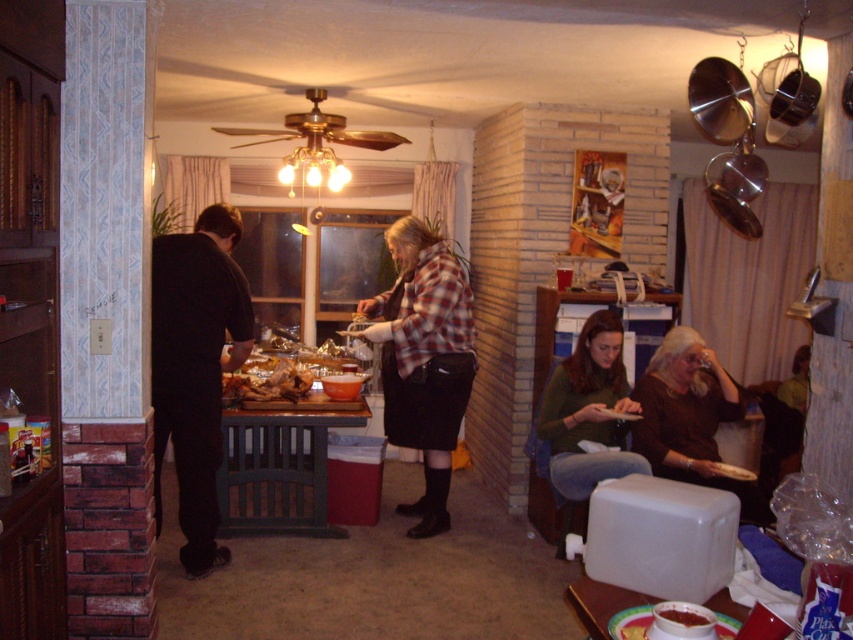
Who is positioned more to the right, black matte suit at left or plaid fabric shirt at center?

plaid fabric shirt at center is more to the right.

Looking at this image, does black matte suit at left have a greater width compared to plaid fabric shirt at center?

No, black matte suit at left is not wider than plaid fabric shirt at center.

Is point (218, 410) positioned after point (389, 314)?

No, (218, 410) is in front of (389, 314).

Locate an element on the screen. The image size is (853, 640). black matte suit at left is located at coordinates (195, 369).

Which is below, golden crispy chicken at center or smooth tomato soup at center?

smooth tomato soup at center is below.

Where is `golden crispy chicken at center`? This screenshot has width=853, height=640. golden crispy chicken at center is located at coordinates (268, 384).

Can you confirm if black matte suit at left is positioned to the left of brown matte sweater at lower right?

Yes, black matte suit at left is to the left of brown matte sweater at lower right.

Who is higher up, black matte suit at left or brown matte sweater at lower right?

black matte suit at left is above.

Locate an element on the screen. Image resolution: width=853 pixels, height=640 pixels. black matte suit at left is located at coordinates (195, 369).

Where is `black matte suit at left`? The width and height of the screenshot is (853, 640). black matte suit at left is located at coordinates click(x=195, y=369).